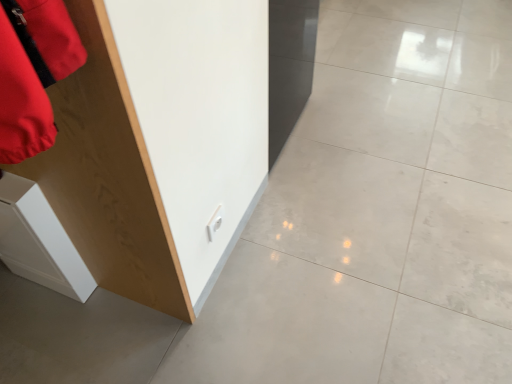
Question: Is white polished concrete at center in front of wooden cabinet at left?

Choices:
 (A) no
 (B) yes

Answer: (A)

Question: Is white polished concrete at center far from wooden cabinet at left?

Choices:
 (A) no
 (B) yes

Answer: (A)

Question: Is white polished concrete at center at the right side of wooden cabinet at left?

Choices:
 (A) no
 (B) yes

Answer: (B)

Question: Is white polished concrete at center taller than wooden cabinet at left?

Choices:
 (A) no
 (B) yes

Answer: (A)

Question: Can you confirm if white polished concrete at center is bigger than wooden cabinet at left?

Choices:
 (A) yes
 (B) no

Answer: (A)

Question: Does white polished concrete at center have a lesser width compared to wooden cabinet at left?

Choices:
 (A) no
 (B) yes

Answer: (A)

Question: Is white glossy cabinet at lower left not within white polished concrete at center?

Choices:
 (A) yes
 (B) no

Answer: (A)

Question: From a real-world perspective, is white glossy cabinet at lower left positioned over white polished concrete at center based on gravity?

Choices:
 (A) yes
 (B) no

Answer: (A)

Question: Is white glossy cabinet at lower left far away from white polished concrete at center?

Choices:
 (A) yes
 (B) no

Answer: (B)

Question: Is white glossy cabinet at lower left at the left side of white polished concrete at center?

Choices:
 (A) no
 (B) yes

Answer: (B)

Question: From a real-world perspective, does white glossy cabinet at lower left sit lower than white polished concrete at center?

Choices:
 (A) no
 (B) yes

Answer: (A)

Question: From the image's perspective, would you say white glossy cabinet at lower left is shown under white polished concrete at center?

Choices:
 (A) no
 (B) yes

Answer: (B)

Question: Considering the relative sizes of white polished concrete at center and white glossy cabinet at lower left in the image provided, is white polished concrete at center shorter than white glossy cabinet at lower left?

Choices:
 (A) no
 (B) yes

Answer: (B)